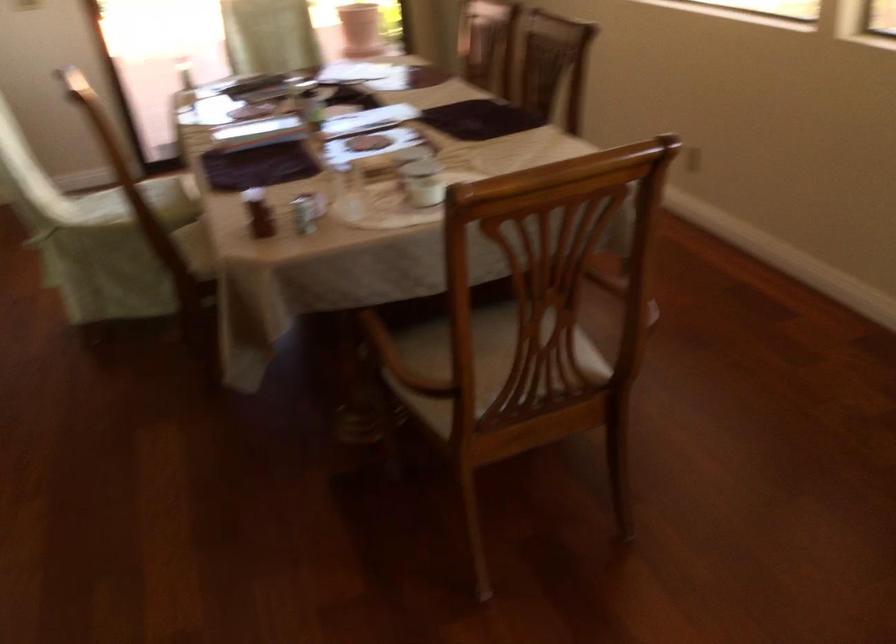
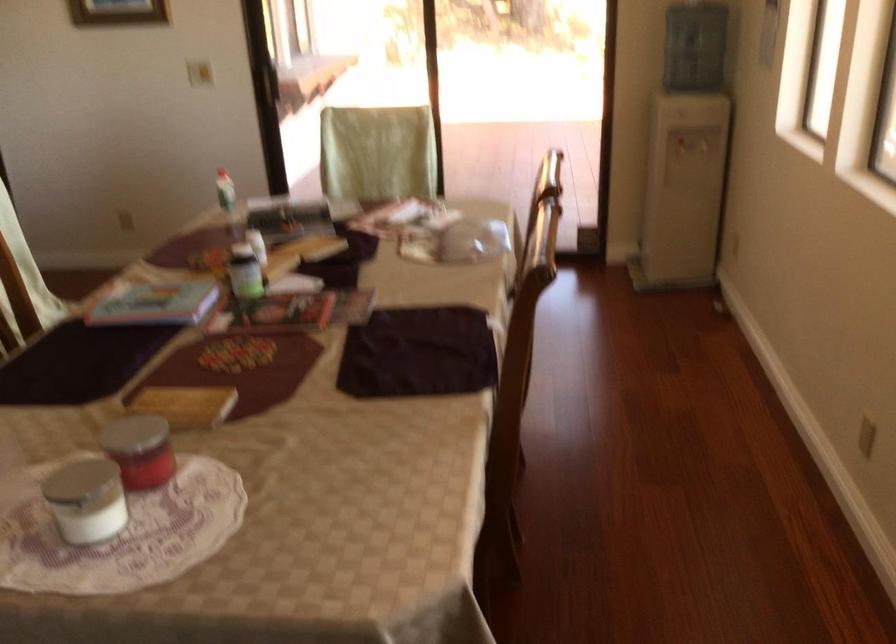
Based on the photo, what movement of the cameraman would produce the second image?

The cameraman walked toward right, forward.